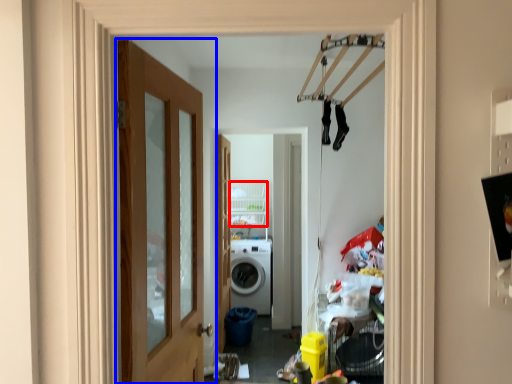
Question: Which object is further to the camera taking this photo, shelf (highlighted by a red box) or door (highlighted by a blue box)?

Choices:
 (A) shelf
 (B) door

Answer: (A)